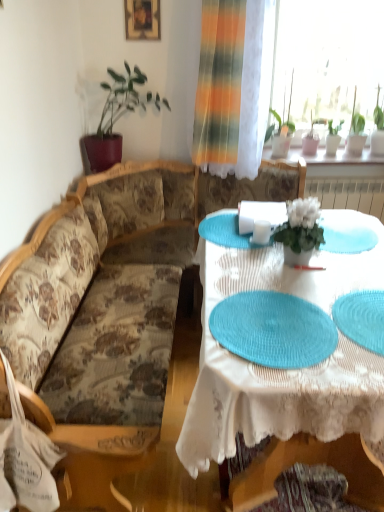
Find the location of a particular element. This screenshot has width=384, height=512. free space that is in between teal woven placemat at center and white matte flower pot at center, placed as the 2th houseplant when sorted from left to right is located at coordinates (284, 283).